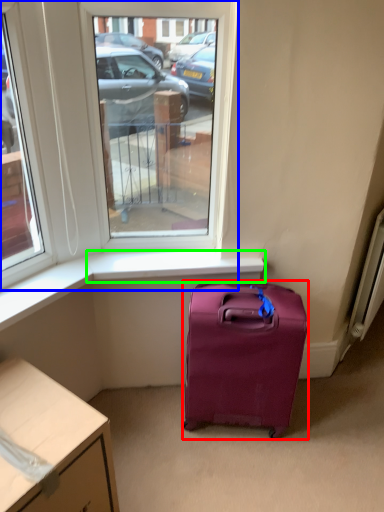
Question: Which object is positioned closest to luggage and bags (highlighted by a red box)? Select from window (highlighted by a blue box) and window sill (highlighted by a green box).

Choices:
 (A) window
 (B) window sill

Answer: (B)